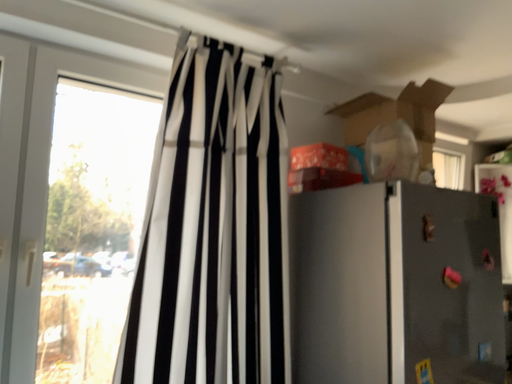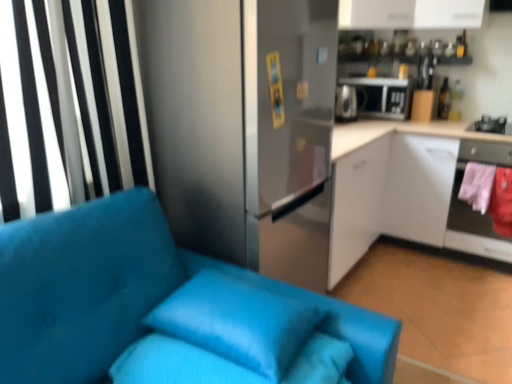
Question: How did the camera likely rotate when shooting the video?

Choices:
 (A) rotated right
 (B) rotated left

Answer: (A)